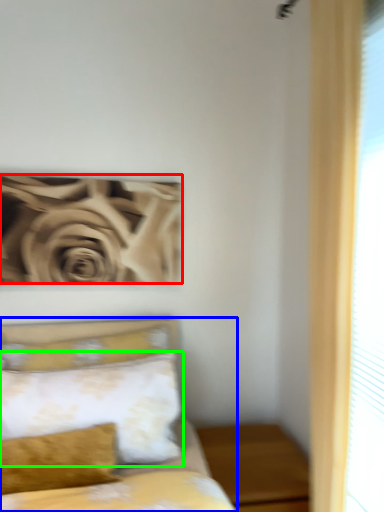
Question: Which object is the closest to the rose (highlighted by a red box)? Choose among these: bed (highlighted by a blue box) or pillow (highlighted by a green box).

Choices:
 (A) bed
 (B) pillow

Answer: (A)